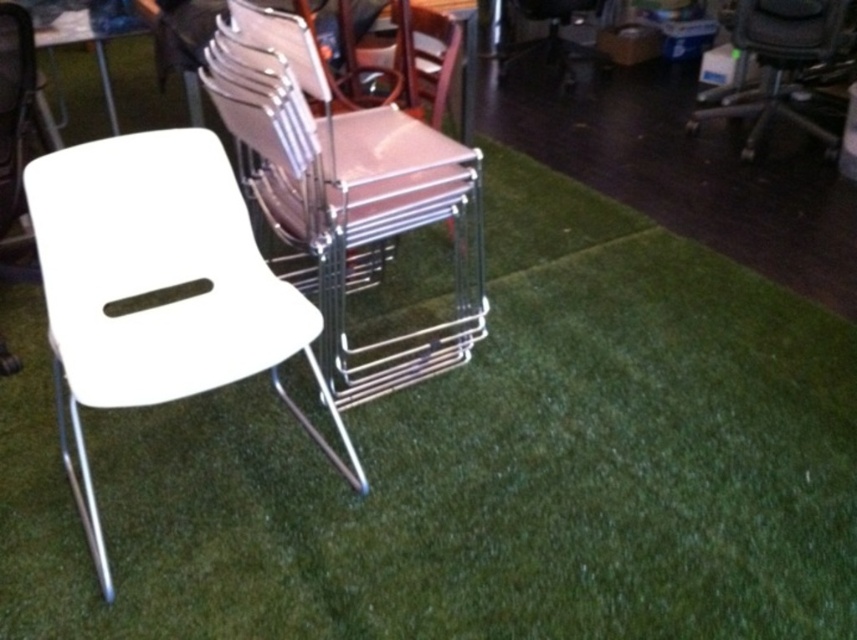
Consider the image. Is matte black chair at upper right above white plastic table at upper left?

Indeed, matte black chair at upper right is positioned over white plastic table at upper left.

Which is in front, point (732, 96) or point (99, 38)?

Positioned in front is point (99, 38).

Locate an element on the screen. matte black chair at upper right is located at coordinates (778, 61).

Between white plastic chair at center and white glossy chair at center, which one is positioned lower?

Positioned lower is white plastic chair at center.

This screenshot has height=640, width=857. What do you see at coordinates (159, 289) in the screenshot? I see `white plastic chair at center` at bounding box center [159, 289].

Locate an element on the screen. This screenshot has height=640, width=857. white plastic chair at center is located at coordinates (159, 289).

Does white plastic chair at center appear under white plastic table at upper left?

Indeed, white plastic chair at center is positioned under white plastic table at upper left.

Between white plastic chair at center and white plastic table at upper left, which one appears on the right side from the viewer's perspective?

white plastic chair at center

Measure the distance between white plastic chair at center and camera.

white plastic chair at center and camera are 4.23 feet apart from each other.

The width and height of the screenshot is (857, 640). What are the coordinates of `white plastic chair at center` in the screenshot? It's located at (159, 289).